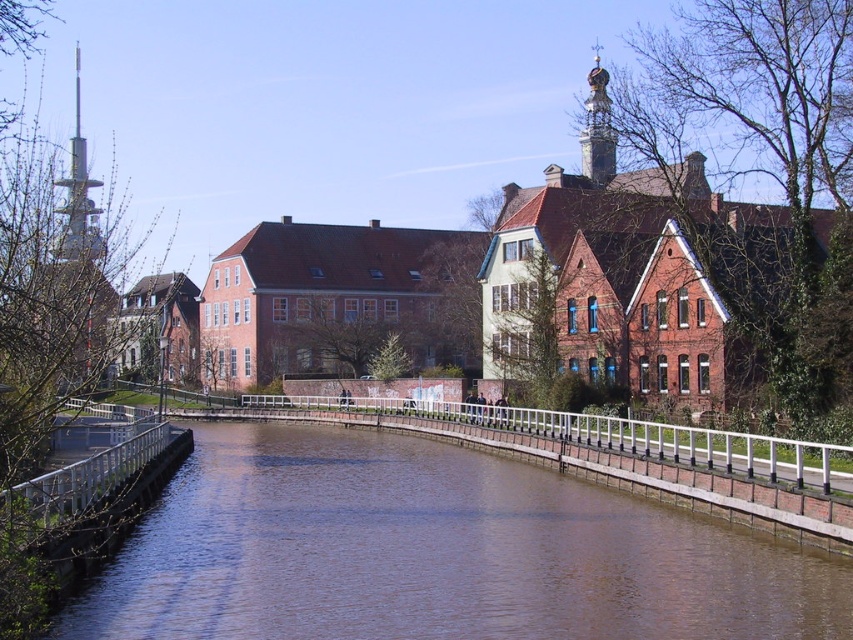
In the scene shown: You are an architect visiting the riverside and want to take a photo of the gold ornate tower at upper center and the brown smooth water at center. Which object would appear larger in your photo?

The gold ornate tower at upper center would appear larger in the photo since it is larger than the brown smooth water at center according to the description.

You are a tourist standing at the riverside and want to take a photo of the brushed metal tower at left. The camera you have can focus on objects up to 70 meters away. Will the tower be in focus?

The brushed metal tower at left is 69.04 meters away from camera, so it will be within the camera focus range of up to 70 meters, so yes, the tower will be in focus.

Based on the photo, you are a tourist standing on the riverside path and want to take a photo that includes both the brown smooth water at center and the brushed metal tower at left. Which object should you position closer to the edge of your camera frame to ensure both are visible?

You should position the brown smooth water at center closer to the edge of your camera frame because it is smaller than the brushed metal tower at left, allowing both to fit within the frame.